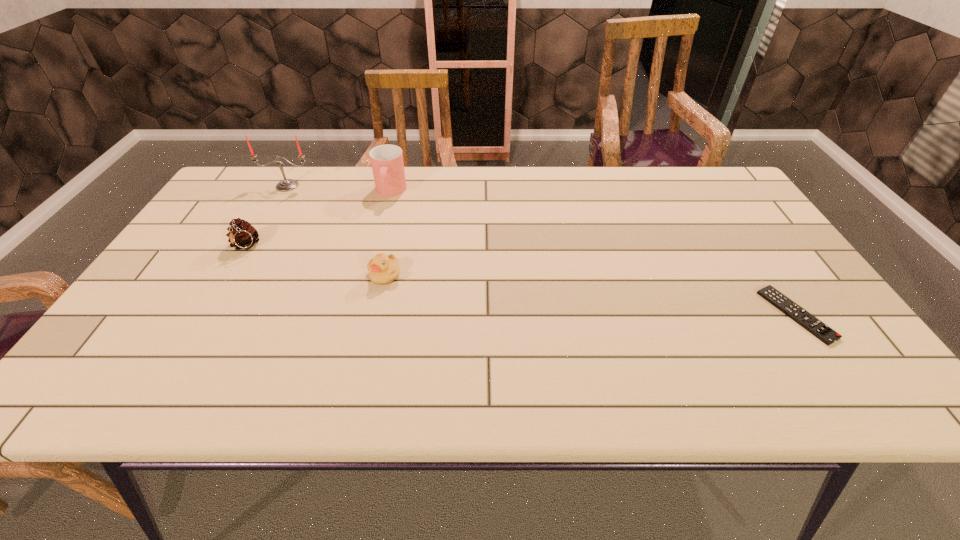
Where is `free space located 0.050m with a leaf charm attached to the third shortest object`? free space located 0.050m with a leaf charm attached to the third shortest object is located at coordinates (230, 272).

At what (x,y) coordinates should I click in order to perform the action: click on vacant area located 0.170m on the beak of the fourth farthest object. Please return your answer as a coordinate pair (x, y). This screenshot has height=540, width=960. Looking at the image, I should click on (370, 343).

In order to click on free region located 0.150m on the back of the remote control in this screenshot , I will do `click(750, 247)`.

Identify the location of candle that is at the far edge. (285, 185).

This screenshot has height=540, width=960. I want to click on cup located at the far edge, so click(x=387, y=163).

You are a GUI agent. You are given a task and a screenshot of the screen. Output one action in this format:
    pyautogui.click(x=<x>, y=<y>)
    Task: Click on the candle located at the left edge
    The image size is (960, 540).
    Given the screenshot: What is the action you would take?
    pyautogui.click(x=285, y=185)

Where is `pinecone that is at the left edge`? Image resolution: width=960 pixels, height=540 pixels. pinecone that is at the left edge is located at coordinates (241, 234).

Identify the location of object located at the right edge. The width and height of the screenshot is (960, 540). (820, 330).

Where is `object that is at the far left corner`? The image size is (960, 540). object that is at the far left corner is located at coordinates (285, 185).

In the image, there is a desktop. Where is `vacant space at the far edge`? The height and width of the screenshot is (540, 960). vacant space at the far edge is located at coordinates (480, 165).